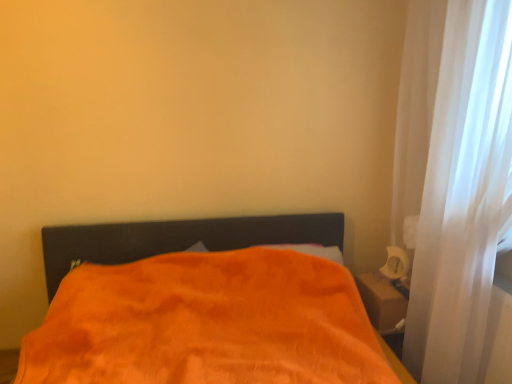
Find the location of `orange plush blanket at center`. orange plush blanket at center is located at coordinates (207, 323).

At what (x,y) coordinates should I click in order to perform the action: click on orange plush blanket at center. Please return your answer as a coordinate pair (x, y). This screenshot has width=512, height=384. Looking at the image, I should click on (x=207, y=323).

In terms of height, does white sheer curtain at right look taller or shorter compared to white glossy table lamp at right?

Clearly, white sheer curtain at right is taller compared to white glossy table lamp at right.

Which object is further away from the camera taking this photo, white sheer curtain at right or white glossy table lamp at right?

white glossy table lamp at right.

Is white sheer curtain at right at the right side of white glossy table lamp at right?

Indeed, white sheer curtain at right is positioned on the right side of white glossy table lamp at right.

Could white glossy table lamp at right be considered to be inside white sheer curtain at right?

Indeed, white glossy table lamp at right is located within white sheer curtain at right.

Does point (394, 277) come farther from viewer compared to point (420, 281)?

Yes.

How different are the orientations of white glossy table lamp at right and white sheer curtain at right in degrees?

26.2 degrees.

Who is smaller, white glossy table lamp at right or white sheer curtain at right?

Smaller between the two is white glossy table lamp at right.

Consider the image. Considering the relative sizes of white sheer curtain at right and orange plush blanket at center in the image provided, is white sheer curtain at right smaller than orange plush blanket at center?

Yes, white sheer curtain at right is smaller than orange plush blanket at center.

From the picture: Is white sheer curtain at right next to orange plush blanket at center?

No, white sheer curtain at right is not with orange plush blanket at center.

Which of these two, white sheer curtain at right or orange plush blanket at center, stands shorter?

With less height is orange plush blanket at center.

Which of these two, white sheer curtain at right or orange plush blanket at center, is thinner?

white sheer curtain at right.

Can we say white glossy table lamp at right lies outside orange plush blanket at center?

Yes, white glossy table lamp at right is outside of orange plush blanket at center.

Is white glossy table lamp at right aimed at orange plush blanket at center?

Yes.

Considering the sizes of white glossy table lamp at right and orange plush blanket at center in the image, is white glossy table lamp at right taller or shorter than orange plush blanket at center?

white glossy table lamp at right is shorter than orange plush blanket at center.

Who is taller, orange plush blanket at center or white sheer curtain at right?

Standing taller between the two is white sheer curtain at right.

Is orange plush blanket at center far from white sheer curtain at right?

No, orange plush blanket at center is in close proximity to white sheer curtain at right.

Who is bigger, orange plush blanket at center or white sheer curtain at right?

orange plush blanket at center is bigger.

Is white glossy table lamp at right a part of orange plush blanket at center?

No.

Can you tell me how much orange plush blanket at center and white glossy table lamp at right differ in facing direction?

They differ by 63.8 degrees in their facing directions.

In the scene shown: Is orange plush blanket at center taller or shorter than white glossy table lamp at right?

In the image, orange plush blanket at center appears to be taller than white glossy table lamp at right.

Could you tell me if orange plush blanket at center is turned towards white glossy table lamp at right?

No.

The image size is (512, 384). I want to click on table lamp directly beneath the white sheer curtain at right (from a real-world perspective), so click(396, 265).

In order to click on table lamp on the left of white sheer curtain at right in this screenshot , I will do `click(396, 265)`.

Based on their spatial positions, is orange plush blanket at center or white glossy table lamp at right closer to white sheer curtain at right?

white glossy table lamp at right is positioned closer to the anchor white sheer curtain at right.

Considering their positions, is white sheer curtain at right positioned closer to orange plush blanket at center than white glossy table lamp at right?

white sheer curtain at right lies closer to orange plush blanket at center than the other object.

Estimate the real-world distances between objects in this image. Which object is closer to orange plush blanket at center, white glossy table lamp at right or white sheer curtain at right?

The object closer to orange plush blanket at center is white sheer curtain at right.

Which object lies further to the anchor point white glossy table lamp at right, white sheer curtain at right or orange plush blanket at center?

orange plush blanket at center is positioned further to the anchor white glossy table lamp at right.

Based on their spatial positions, is orange plush blanket at center or white sheer curtain at right closer to white glossy table lamp at right?

Among the two, white sheer curtain at right is located nearer to white glossy table lamp at right.

Considering their positions, is white glossy table lamp at right positioned further to white sheer curtain at right than orange plush blanket at center?

orange plush blanket at center.

Where is `curtain located between orange plush blanket at center and white glossy table lamp at right in the depth direction`? curtain located between orange plush blanket at center and white glossy table lamp at right in the depth direction is located at coordinates pos(452,176).